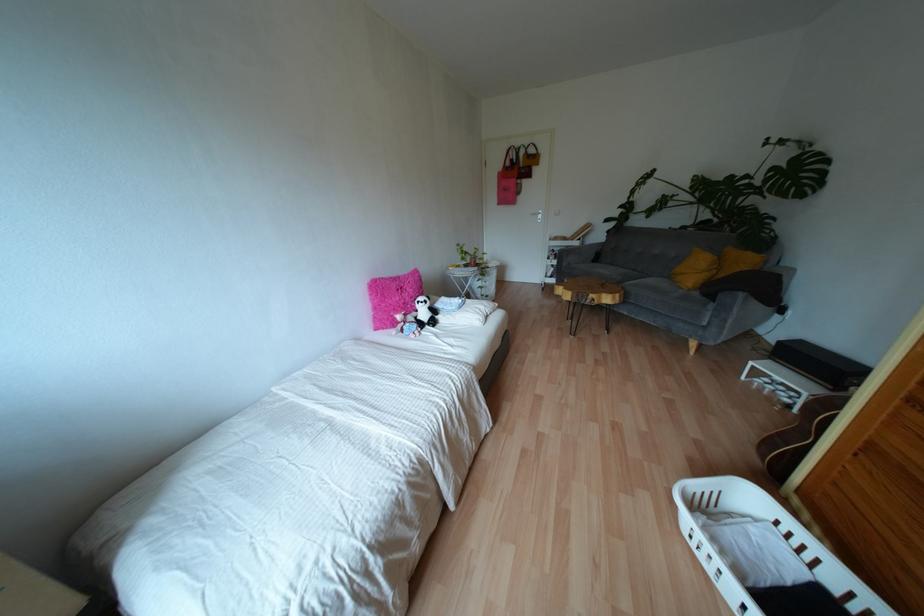
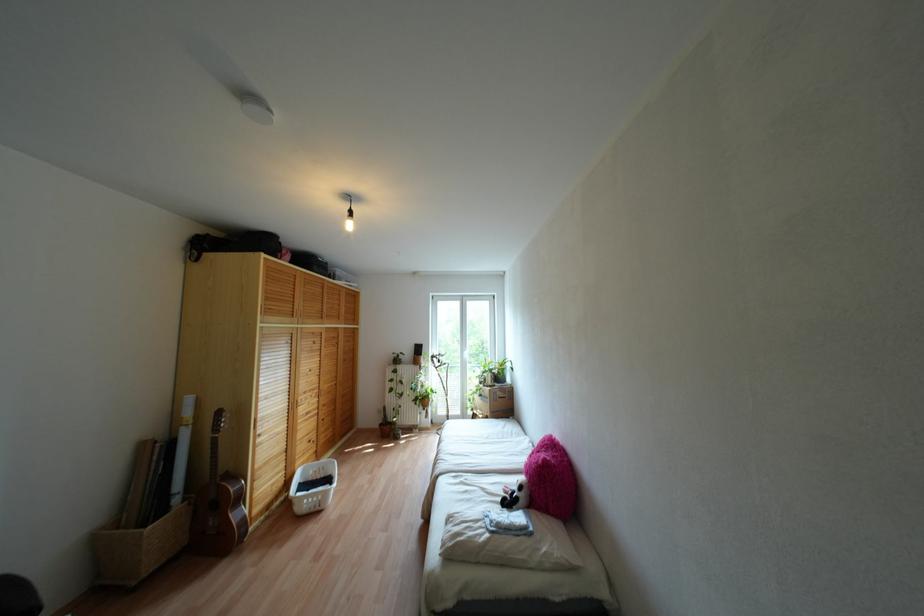
Where in the second image is the point corresponding to the point at 435,336 from the first image?

(482, 488)